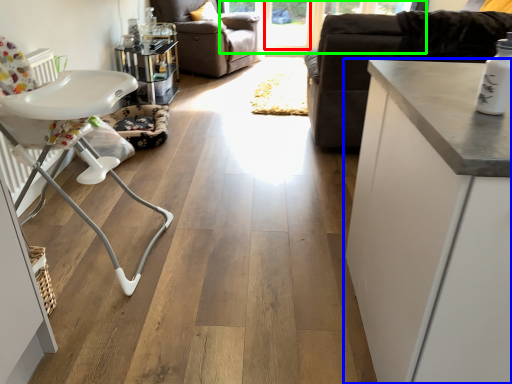
Question: Considering the real-world distances, which object is farthest from window screen (highlighted by a red box)? cabinetry (highlighted by a blue box) or window screen (highlighted by a green box)?

Choices:
 (A) cabinetry
 (B) window screen

Answer: (A)